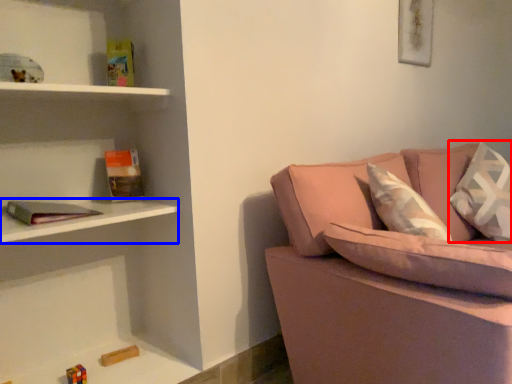
Question: Which object appears closest to the camera in this image, pillow (highlighted by a red box) or cabinet (highlighted by a blue box)?

Choices:
 (A) pillow
 (B) cabinet

Answer: (B)